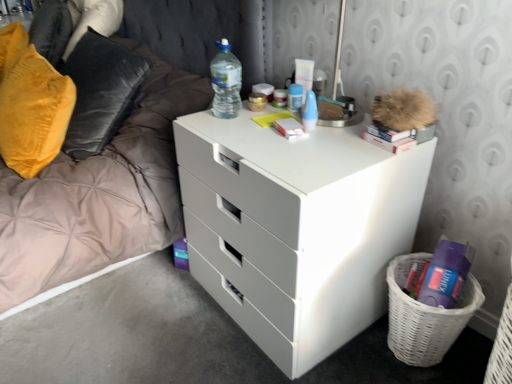
Locate an element on the screen. Image resolution: width=512 pixels, height=384 pixels. free space to the left of white wicker basket at lower right is located at coordinates (353, 359).